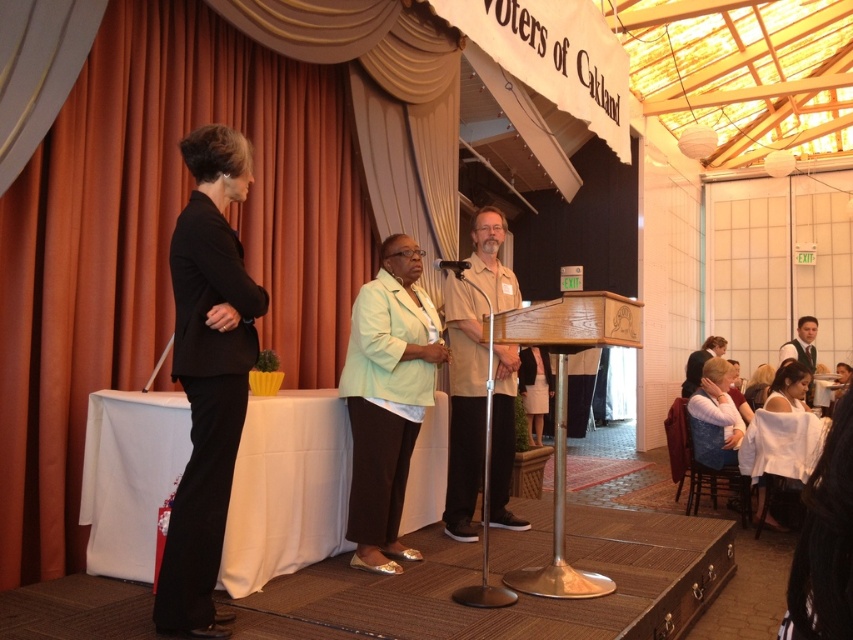
Question: Which object is farther from the camera taking this photo?

Choices:
 (A) white satin dress at lower right
 (B) light brown hair at upper right

Answer: (B)

Question: Is the position of orange velvet curtain at upper left more distant than that of black matte suit at left?

Choices:
 (A) no
 (B) yes

Answer: (B)

Question: Which of these objects is positioned farthest from the mint green fabric jacket at center?

Choices:
 (A) black matte suit at left
 (B) beige fabric shirt at center

Answer: (A)

Question: Which of the following is the closest to the observer?

Choices:
 (A) white satin dress at lower right
 (B) beige fabric shirt at center
 (C) mint green fabric jacket at center
 (D) black matte suit at left

Answer: (D)

Question: Is orange velvet curtain at upper left bigger than white satin dress at lower right?

Choices:
 (A) no
 (B) yes

Answer: (B)

Question: Does orange velvet curtain at upper left appear on the left side of light brown hair at upper right?

Choices:
 (A) yes
 (B) no

Answer: (A)